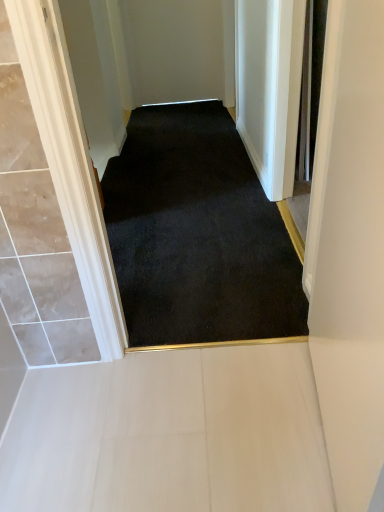
Question: Is matte white door at right in front of or behind black carpet at center in the image?

Choices:
 (A) front
 (B) behind

Answer: (A)

Question: Looking at the image, does matte white door at right seem bigger or smaller compared to black carpet at center?

Choices:
 (A) big
 (B) small

Answer: (B)

Question: Which object is the farthest from the black carpet at center?

Choices:
 (A) white tile floor at lower center
 (B) matte white door at right

Answer: (B)

Question: Estimate the real-world distances between objects in this image. Which object is farther from the white tile floor at lower center?

Choices:
 (A) black carpet at center
 (B) matte white door at right

Answer: (A)